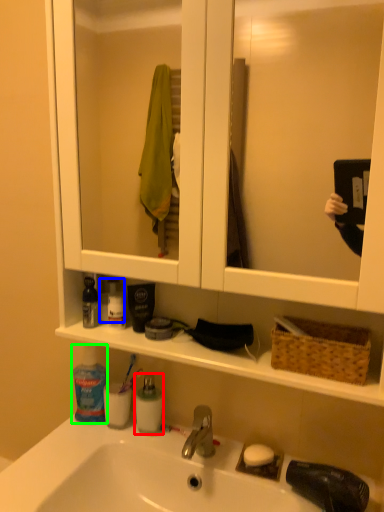
Question: Which object is the farthest from cleaning product (highlighted by a red box)? Choose among these: mouthwash (highlighted by a blue box) or toiletry (highlighted by a green box).

Choices:
 (A) mouthwash
 (B) toiletry

Answer: (A)